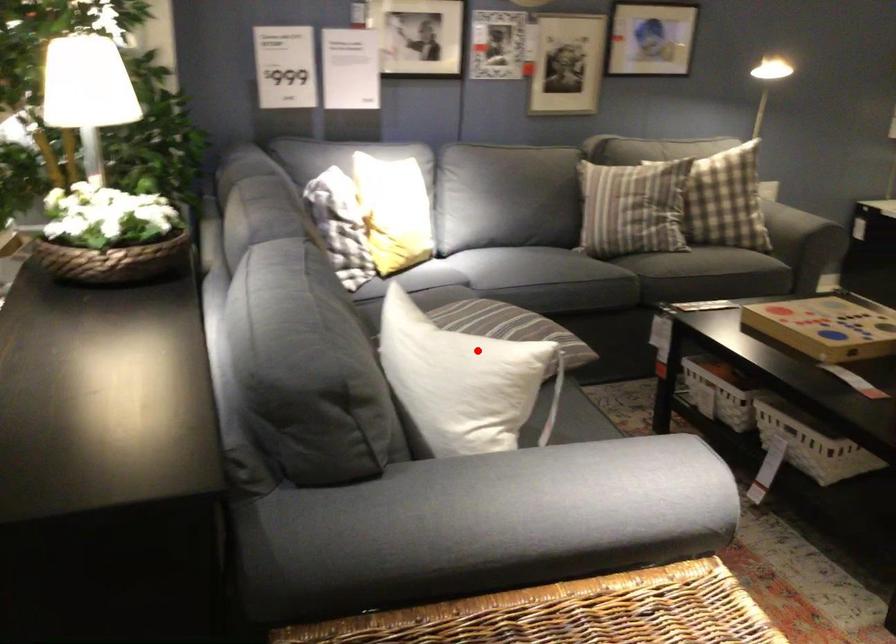
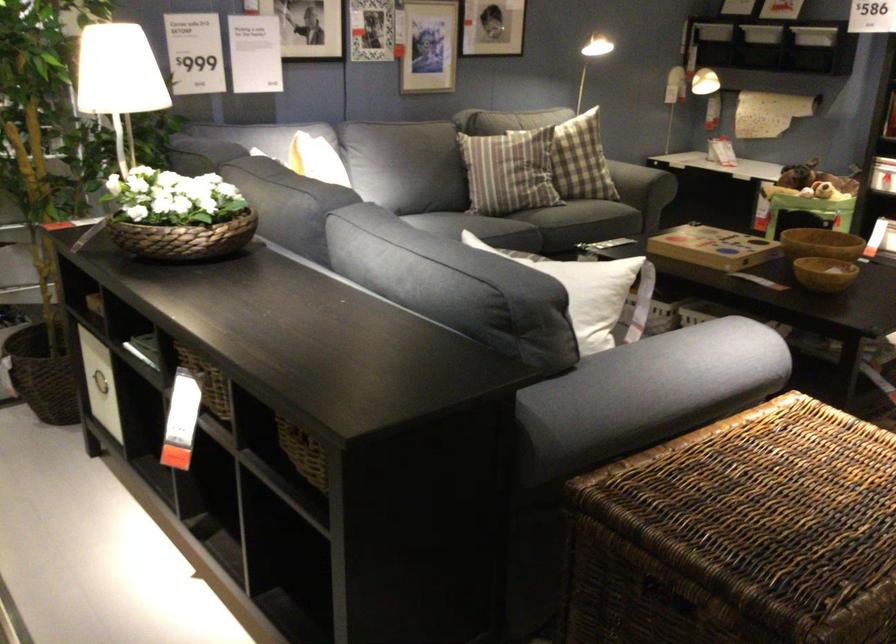
In the second image, find the point that corresponds to the highlighted location in the first image.

(581, 272)